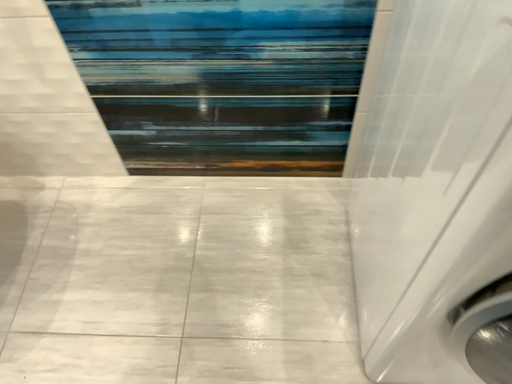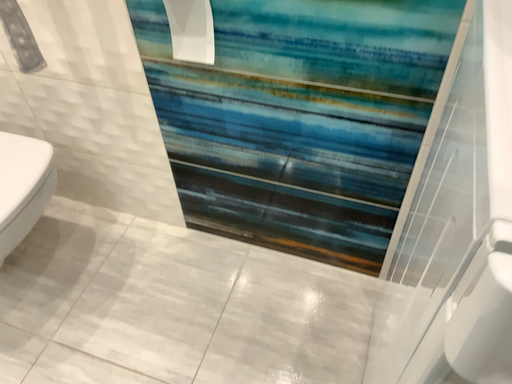
Question: Which way did the camera rotate in the video?

Choices:
 (A) rotated downward
 (B) rotated upward

Answer: (B)